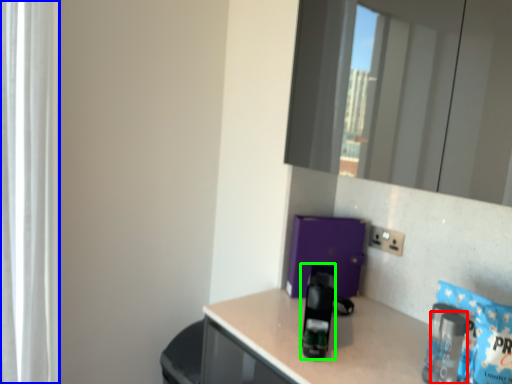
Question: Considering the real-world distances, which object is farthest from bottle (highlighted by a red box)? curtain (highlighted by a blue box) or appliance (highlighted by a green box)?

Choices:
 (A) curtain
 (B) appliance

Answer: (A)